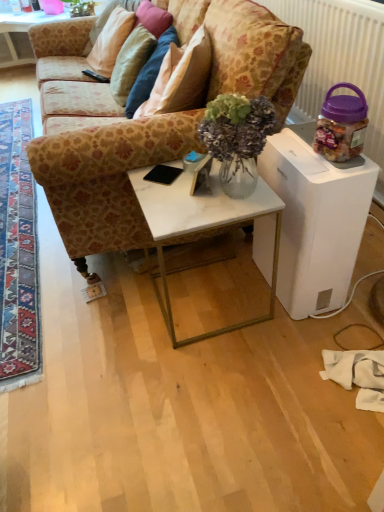
Question: From the image's perspective, is white marble table at center, the 3th table viewed from the right, positioned above or below patterned fabric couch at center?

Choices:
 (A) above
 (B) below

Answer: (A)

Question: From their relative heights in the image, would you say white marble table at center, which is the 1th table in back-to-front order, is taller or shorter than patterned fabric couch at center?

Choices:
 (A) short
 (B) tall

Answer: (A)

Question: Which object is the closest to the carpeted rug at lower left?

Choices:
 (A) beige fabric pillow at upper left, the second pillow from the right
 (B) translucent glass vase at center
 (C) white marble table at center, the 3th table viewed from the right
 (D) black plastic remote control at upper left
 (E) white marble table at center, which is counted as the first table, starting from the bottom

Answer: (E)

Question: Considering the real-world distances, which object is farthest from the beige fabric pillow at upper left, which is the first pillow from left to right?

Choices:
 (A) white marble table at center, which is counted as the first table, starting from the bottom
 (B) velvet beige pillow at upper center, which ranks as the second pillow in left-to-right order
 (C) black plastic remote control at upper left
 (D) white marble table at center, positioned as the 3th table in bottom-to-top order
 (E) carpeted rug at lower left

Answer: (A)